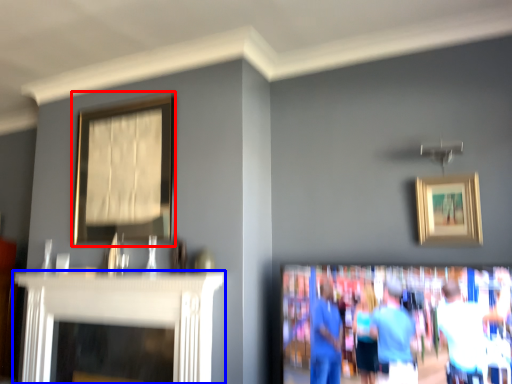
Question: Among these objects, which one is farthest to the camera, picture frame (highlighted by a red box) or fireplace (highlighted by a blue box)?

Choices:
 (A) picture frame
 (B) fireplace

Answer: (A)